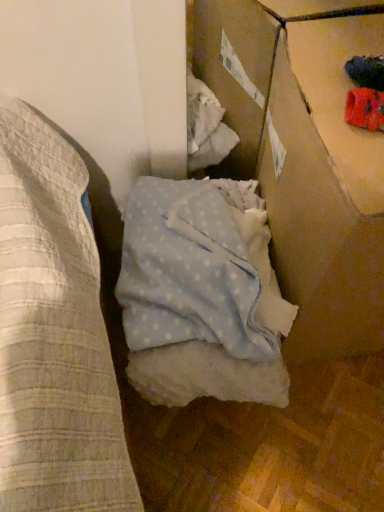
The width and height of the screenshot is (384, 512). Describe the element at coordinates (201, 294) in the screenshot. I see `light blue polka dot fabric at center` at that location.

The image size is (384, 512). Identify the location of light blue polka dot fabric at center. (201, 294).

What is the approximate width of cardboard box at upper right?

cardboard box at upper right is 15.09 inches in width.

What do you see at coordinates (294, 186) in the screenshot?
I see `cardboard box at upper right` at bounding box center [294, 186].

Locate an element on the screen. The width and height of the screenshot is (384, 512). cardboard box at upper right is located at coordinates (294, 186).

Where is `light blue polka dot fabric at center`? This screenshot has width=384, height=512. light blue polka dot fabric at center is located at coordinates (201, 294).

Considering the positions of objects cardboard box at upper right and light blue polka dot fabric at center in the image provided, who is more to the right, cardboard box at upper right or light blue polka dot fabric at center?

cardboard box at upper right.

In the image, is cardboard box at upper right positioned in front of or behind light blue polka dot fabric at center?

cardboard box at upper right is positioned closer to the viewer than light blue polka dot fabric at center.

Between point (351, 313) and point (241, 351), which one is positioned in front?

Point (241, 351)

From the image's perspective, who appears lower, cardboard box at upper right or light blue polka dot fabric at center?

light blue polka dot fabric at center, from the image's perspective.

From a real-world perspective, is cardboard box at upper right on light blue polka dot fabric at center?

Yes.

In the scene shown: Which of these two, cardboard box at upper right or light blue polka dot fabric at center, is thinner?

Thinner between the two is cardboard box at upper right.

Who is shorter, cardboard box at upper right or light blue polka dot fabric at center?

Standing shorter between the two is light blue polka dot fabric at center.

Can you confirm if cardboard box at upper right is bigger than light blue polka dot fabric at center?

Result: Correct, cardboard box at upper right is larger in size than light blue polka dot fabric at center.

Is cardboard box at upper right inside the boundaries of light blue polka dot fabric at center, or outside?

The correct answer is: outside.

Is cardboard box at upper right not near light blue polka dot fabric at center?

No, cardboard box at upper right is not far away from light blue polka dot fabric at center.

Is cardboard box at upper right facing towards light blue polka dot fabric at center?

No, cardboard box at upper right is not aimed at light blue polka dot fabric at center.

Locate an element on the screen. The height and width of the screenshot is (512, 384). sheet lying behind the cardboard box at upper right is located at coordinates (201, 294).

Considering the relative positions of light blue polka dot fabric at center and cardboard box at upper right in the image provided, is light blue polka dot fabric at center to the left or to the right of cardboard box at upper right?

Clearly, light blue polka dot fabric at center is on the left of cardboard box at upper right in the image.

Consider the image. Is light blue polka dot fabric at center positioned before cardboard box at upper right?

That is False.

Which is closer, (256, 324) or (294, 273)?

Positioned in front is point (256, 324).

From the picture: From the image's perspective, between light blue polka dot fabric at center and cardboard box at upper right, which one is located above?

cardboard box at upper right appears higher in the image.

From a real-world perspective, which is physically below, light blue polka dot fabric at center or cardboard box at upper right?

From a 3D spatial view, light blue polka dot fabric at center is below.

Considering the relative sizes of light blue polka dot fabric at center and cardboard box at upper right in the image provided, is light blue polka dot fabric at center wider than cardboard box at upper right?

Correct, the width of light blue polka dot fabric at center exceeds that of cardboard box at upper right.

Consider the image. Does light blue polka dot fabric at center have a greater height compared to cardboard box at upper right?

No.

Which of these two, light blue polka dot fabric at center or cardboard box at upper right, is bigger?

With larger size is cardboard box at upper right.

Which is correct: light blue polka dot fabric at center is inside cardboard box at upper right, or outside of it?

light blue polka dot fabric at center lies outside cardboard box at upper right.

Based on the photo, does light blue polka dot fabric at center touch cardboard box at upper right?

No, light blue polka dot fabric at center is not next to cardboard box at upper right.

Is cardboard box at upper right at the back of light blue polka dot fabric at center?

light blue polka dot fabric at center is not turned away from cardboard box at upper right.

How far apart are light blue polka dot fabric at center and cardboard box at upper right?

light blue polka dot fabric at center and cardboard box at upper right are 15.87 centimeters apart from each other.

Locate an element on the screen. This screenshot has width=384, height=512. sheet behind the cardboard box at upper right is located at coordinates (201, 294).

Find the location of `cardboard box above the light blue polka dot fabric at center (from a real-world perspective)`. cardboard box above the light blue polka dot fabric at center (from a real-world perspective) is located at coordinates (x=294, y=186).

Where is `cardboard box on the right side of light blue polka dot fabric at center`? cardboard box on the right side of light blue polka dot fabric at center is located at coordinates (294, 186).